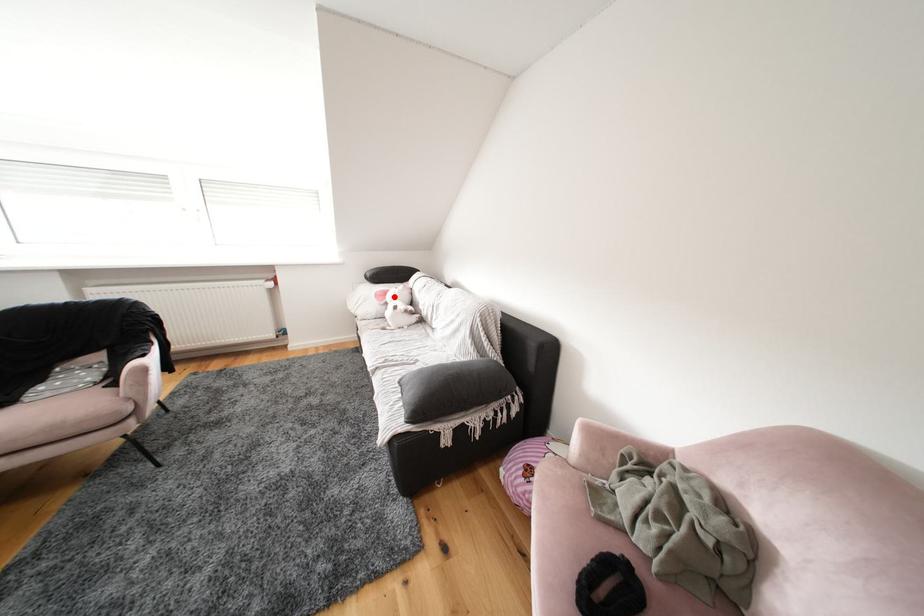
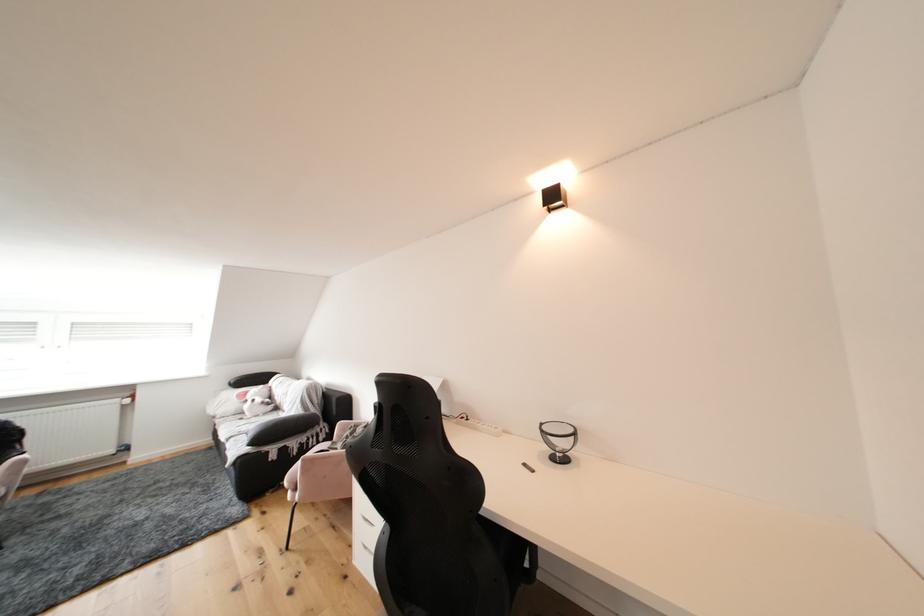
Question: A red point is marked in image1. In image2, is the corresponding 3D point closer to the camera or farther? Reply with the corresponding letter.

Choices:
 (A) The corresponding 3D point is closer.
 (B) The corresponding 3D point is farther.

Answer: (B)